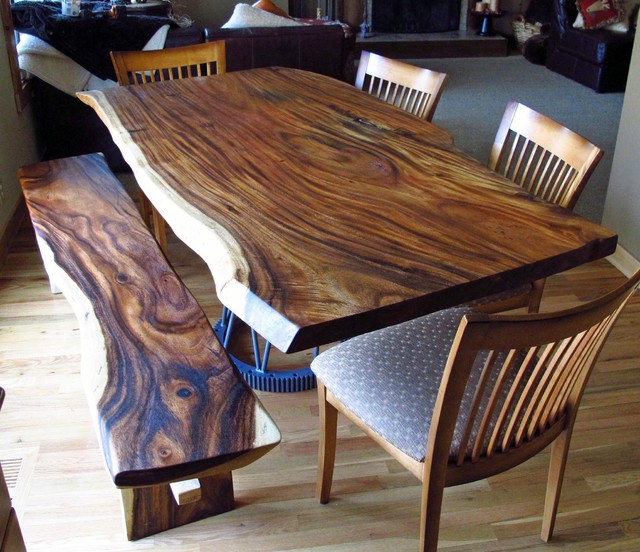
This screenshot has width=640, height=552. I want to click on table base, so click(285, 382).